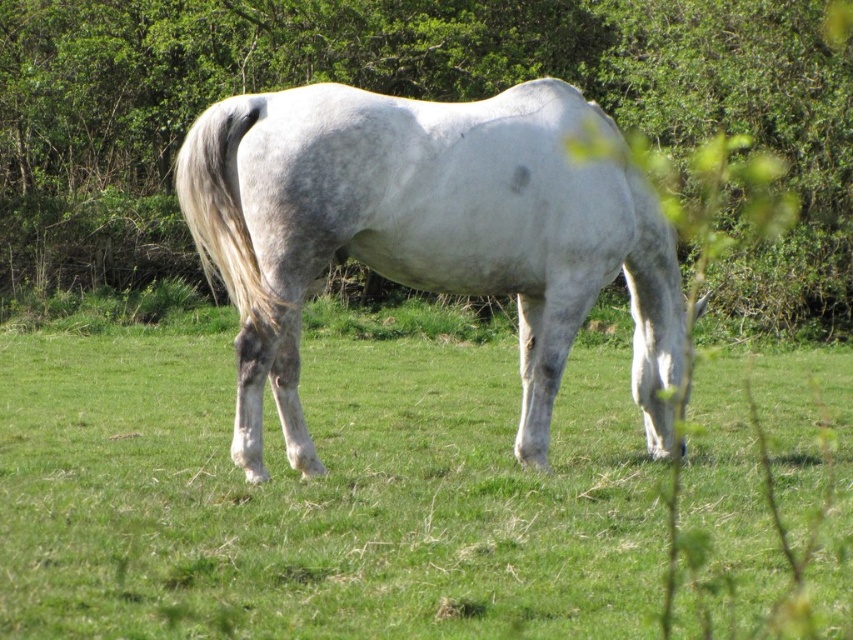
Question: Among these points, which one is farthest from the camera?

Choices:
 (A) (386, 160)
 (B) (395, 396)

Answer: (B)

Question: Does green grass at center have a greater width compared to white matte horse at center?

Choices:
 (A) yes
 (B) no

Answer: (A)

Question: Does green leafy tree at center appear on the left side of white matte horse at center?

Choices:
 (A) no
 (B) yes

Answer: (B)

Question: Which point appears farthest from the camera in this image?

Choices:
 (A) (73, 131)
 (B) (282, 128)

Answer: (A)

Question: Which of the following is the farthest from the observer?

Choices:
 (A) (x=144, y=120)
 (B) (x=625, y=172)
 (C) (x=730, y=394)

Answer: (A)

Question: Is green grass at center bigger than white matte horse at center?

Choices:
 (A) yes
 (B) no

Answer: (A)